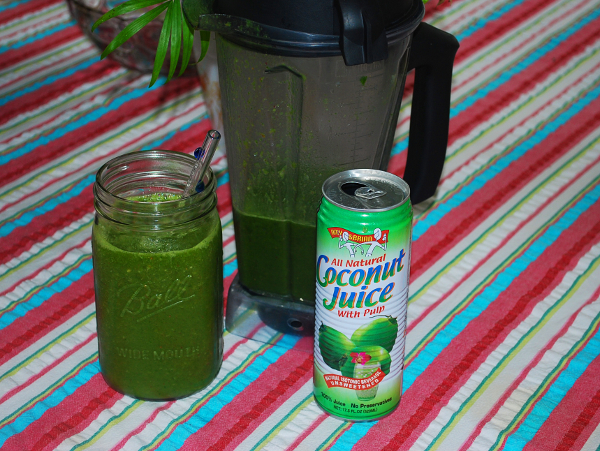
At what (x,y) coordinates should I click in order to perform the action: click on tablecloth. Please return your answer as a coordinate pair (x, y). The height and width of the screenshot is (451, 600). Looking at the image, I should click on (519, 267).